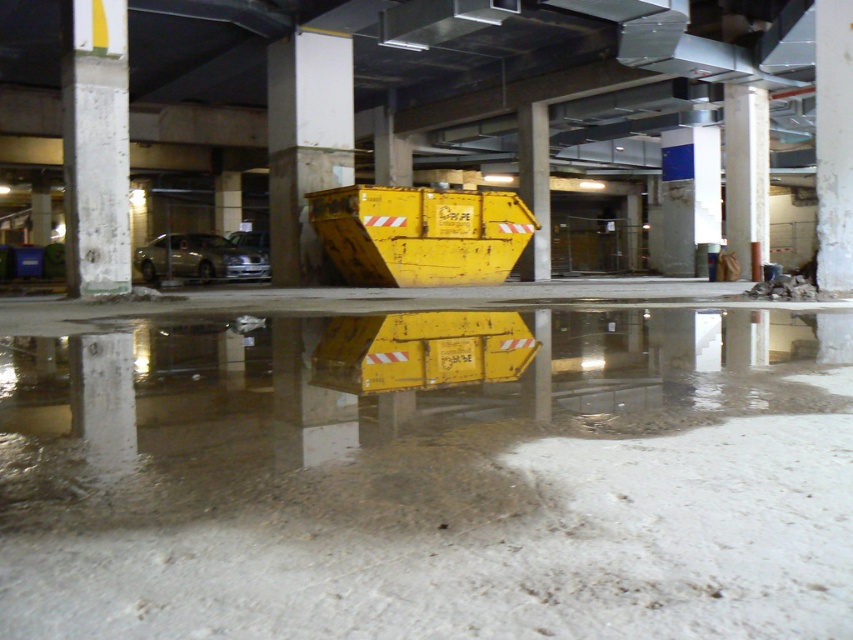
You are a delivery person entering the parking garage and need to locate two specific points marked on your map. The first point is at coordinates point (111, 140) and the second is at point (306, 179). Which point is closer to the entrance of the garage?

Point (111, 140) is in front of point (306, 179), so it is closer to the entrance of the garage.

From the picture: You are driving a car and want to park in the underground parking garage. You see the white concrete pillar at left and the concrete at center. Which one is closer to you as you enter the garage?

The white concrete pillar at left is closer to you because it is in front of the concrete at center.

You are a delivery person entering the parking garage and need to avoid the puddle. You see the white concrete pillar at left and the concrete at center. Which one is located to the left of the other?

The white concrete pillar at left is positioned on the left side of the concrete at center, so the white concrete pillar at left is to the left of the concrete at center.